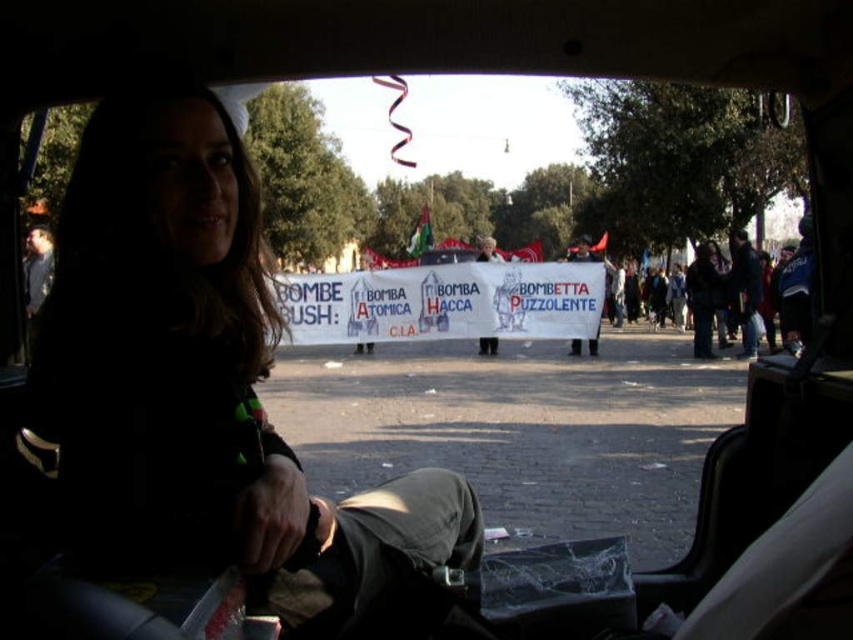
You are a passenger in the car and want to read the banner outside. Which object is closer to you, the dark hair at center or the white paper banner at center?

The dark hair at center is closer to you because it is positioned on the left side of the white paper banner at center, meaning the dark hair is in front of the banner from your viewpoint.

You are a drone operator trying to capture a clear image of the white paper banner at center from your position near the dark hair at center. Given that your drone can fly up to 15 meters, will it be able to reach the banner?

The dark hair at center is 14.80 meters from the white paper banner at center. Since the drone can fly up to 15 meters, it will be able to reach the banner as 14.80 meters is within the drone